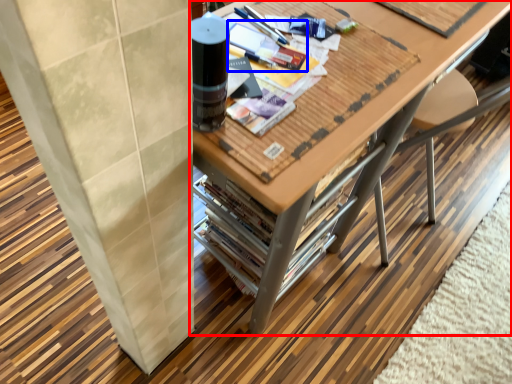
Question: Which point is closer to the camera, table (highlighted by a red box) or magazine (highlighted by a blue box)?

Choices:
 (A) table
 (B) magazine

Answer: (A)